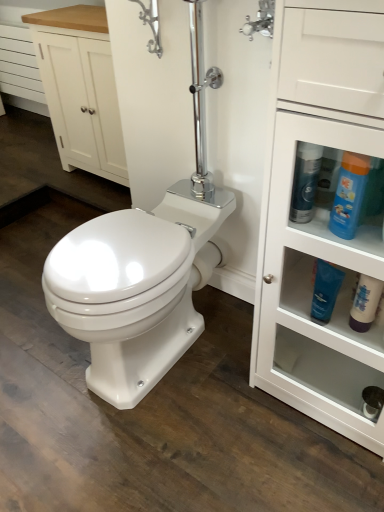
Locate an element on the screen. blue glossy bottle at right, which is counted as the 1th cleaning product, starting from the left is located at coordinates (305, 181).

Measure the distance between point (286, 94) and camera.

A distance of 29.88 inches exists between point (286, 94) and camera.

This screenshot has height=512, width=384. What do you see at coordinates (80, 88) in the screenshot?
I see `white wood cabinet at upper left` at bounding box center [80, 88].

This screenshot has height=512, width=384. I want to click on white matte bottle at lower right, which is the first cleaning product from right to left, so click(365, 303).

Image resolution: width=384 pixels, height=512 pixels. What do you see at coordinates (325, 290) in the screenshot? I see `blue glossy tube at lower right, acting as the 2th cleaning product starting from the left` at bounding box center [325, 290].

The width and height of the screenshot is (384, 512). Identify the location of blue glossy bottle at right, which is counted as the fourth cleaning product, starting from the right. (305, 181).

Is blue glossy tube at lower right, acting as the 2th cleaning product starting from the left, directly adjacent to white wood drawer at upper left?

No, blue glossy tube at lower right, acting as the 2th cleaning product starting from the left, is not touching white wood drawer at upper left.

From a real-world perspective, is blue glossy tube at lower right, the third cleaning product viewed from the right, physically above white wood drawer at upper left?

Indeed, from a real-world perspective, blue glossy tube at lower right, the third cleaning product viewed from the right, stands above white wood drawer at upper left.

From the image's perspective, is blue glossy tube at lower right, acting as the 2th cleaning product starting from the left, below white wood drawer at upper left?

Correct, blue glossy tube at lower right, acting as the 2th cleaning product starting from the left, appears lower than white wood drawer at upper left in the image.

Considering the positions of objects blue glossy tube at lower right, acting as the 2th cleaning product starting from the left, and white wood drawer at upper left in the image provided, who is more to the left, blue glossy tube at lower right, acting as the 2th cleaning product starting from the left, or white wood drawer at upper left?

Positioned to the left is white wood drawer at upper left.

Can you see white glossy cabinet at right touching blue plastic bottle at upper right, which is the 3th cleaning product in left-to-right order?

white glossy cabinet at right and blue plastic bottle at upper right, which is the 3th cleaning product in left-to-right order, are not in contact.

Where is `the 2nd cleaning product directly above the white glossy cabinet at right (from a real-world perspective)`? The height and width of the screenshot is (512, 384). the 2nd cleaning product directly above the white glossy cabinet at right (from a real-world perspective) is located at coordinates (349, 194).

Is white glossy cabinet at right taller than blue plastic bottle at upper right, the second cleaning product when ordered from right to left?

Yes.

Considering the points (282, 273) and (346, 192), which point is behind, point (282, 273) or point (346, 192)?

Point (282, 273)

The height and width of the screenshot is (512, 384). What are the coordinates of `drawer below the white wood cabinet at upper left (from a real-world perspective)` in the screenshot? It's located at (19, 64).

Between white wood drawer at upper left and white wood cabinet at upper left, which one has more height?

white wood cabinet at upper left.

Is white wood drawer at upper left to the right of white wood cabinet at upper left from the viewer's perspective?

No, white wood drawer at upper left is not to the right of white wood cabinet at upper left.

Who is bigger, white wood drawer at upper left or white wood cabinet at upper left?

white wood cabinet at upper left is bigger.

Is white wood cabinet at upper left positioned before white glossy cabinet at right?

No, it is behind white glossy cabinet at right.

Is white glossy cabinet at right located within white wood cabinet at upper left?

No, white glossy cabinet at right is not a part of white wood cabinet at upper left.

Identify the location of bathroom cabinet below the white wood cabinet at upper left (from the image's perspective). This screenshot has height=512, width=384. (322, 215).

In the scene shown: From a real-world perspective, who is located higher, white matte bottle at lower right, which is the first cleaning product from right to left, or blue glossy bottle at right, which is counted as the 1th cleaning product, starting from the left?

blue glossy bottle at right, which is counted as the 1th cleaning product, starting from the left.

From the image's perspective, which object appears higher, white matte bottle at lower right, the 4th cleaning product positioned from the left, or blue glossy bottle at right, which is counted as the fourth cleaning product, starting from the right?

From the image's view, blue glossy bottle at right, which is counted as the fourth cleaning product, starting from the right, is above.

Which object is closer to the camera taking this photo, white matte bottle at lower right, which is the first cleaning product from right to left, or blue glossy bottle at right, which is counted as the 1th cleaning product, starting from the left?

blue glossy bottle at right, which is counted as the 1th cleaning product, starting from the left, is more forward.

Can you confirm if white matte bottle at lower right, the 4th cleaning product positioned from the left, is taller than blue glossy bottle at right, which is counted as the 1th cleaning product, starting from the left?

In fact, white matte bottle at lower right, the 4th cleaning product positioned from the left, may be shorter than blue glossy bottle at right, which is counted as the 1th cleaning product, starting from the left.

Identify the location of the 2nd cleaning product to the left of the white matte bottle at lower right, the 4th cleaning product positioned from the left, counting from the anchor's position. Image resolution: width=384 pixels, height=512 pixels. (325, 290).

From the image's perspective, does white matte bottle at lower right, the 4th cleaning product positioned from the left, appear lower than blue glossy tube at lower right, the third cleaning product viewed from the right?

Correct, white matte bottle at lower right, the 4th cleaning product positioned from the left, appears lower than blue glossy tube at lower right, the third cleaning product viewed from the right, in the image.

Could you tell me if white matte bottle at lower right, the 4th cleaning product positioned from the left, is facing blue glossy tube at lower right, the third cleaning product viewed from the right?

No, white matte bottle at lower right, the 4th cleaning product positioned from the left, does not turn towards blue glossy tube at lower right, the third cleaning product viewed from the right.

Considering the sizes of objects white matte bottle at lower right, the 4th cleaning product positioned from the left, and blue glossy tube at lower right, acting as the 2th cleaning product starting from the left, in the image provided, who is thinner, white matte bottle at lower right, the 4th cleaning product positioned from the left, or blue glossy tube at lower right, acting as the 2th cleaning product starting from the left,?

Thinner between the two is blue glossy tube at lower right, acting as the 2th cleaning product starting from the left.

From the image's perspective, which is below, white wood cabinet at upper left or blue plastic bottle at upper right, the second cleaning product when ordered from right to left?

blue plastic bottle at upper right, the second cleaning product when ordered from right to left, appears lower in the image.

Is white wood cabinet at upper left taller or shorter than blue plastic bottle at upper right, which is the 3th cleaning product in left-to-right order?

Clearly, white wood cabinet at upper left is taller compared to blue plastic bottle at upper right, which is the 3th cleaning product in left-to-right order.

Is white wood cabinet at upper left wider than blue plastic bottle at upper right, the second cleaning product when ordered from right to left?

Yes, white wood cabinet at upper left is wider than blue plastic bottle at upper right, the second cleaning product when ordered from right to left.

Which is in front, point (72, 112) or point (340, 169)?

The point (340, 169) is more forward.

At what (x,y) coordinates should I click in order to perform the action: click on cleaning product that is the 2nd object above the white wood drawer at upper left (from a real-world perspective). Please return your answer as a coordinate pair (x, y). The width and height of the screenshot is (384, 512). Looking at the image, I should click on (325, 290).

I want to click on the 1st cleaning product behind the white glossy cabinet at right, so click(x=349, y=194).

From the image, which object appears to be farther from white glossy cabinet at right, white matte bottle at lower right, which is the first cleaning product from right to left, or white wood drawer at upper left?

white wood drawer at upper left lies further to white glossy cabinet at right than the other object.

From the image, which object appears to be nearer to blue glossy tube at lower right, the third cleaning product viewed from the right, blue glossy bottle at right, which is counted as the fourth cleaning product, starting from the right, or white wood cabinet at upper left?

blue glossy bottle at right, which is counted as the fourth cleaning product, starting from the right, lies closer to blue glossy tube at lower right, the third cleaning product viewed from the right, than the other object.

Considering their positions, is white matte bottle at lower right, which is the first cleaning product from right to left, positioned closer to white glossy cabinet at right than blue glossy tube at lower right, the third cleaning product viewed from the right?

blue glossy tube at lower right, the third cleaning product viewed from the right.

Looking at the image, which one is located further to white wood drawer at upper left, blue glossy tube at lower right, the third cleaning product viewed from the right, or blue glossy bottle at right, which is counted as the fourth cleaning product, starting from the right?

Based on the image, blue glossy tube at lower right, the third cleaning product viewed from the right, appears to be further to white wood drawer at upper left.

Which object lies further to the anchor point blue glossy bottle at right, which is counted as the 1th cleaning product, starting from the left, blue glossy tube at lower right, acting as the 2th cleaning product starting from the left, or blue plastic bottle at upper right, which is the 3th cleaning product in left-to-right order?

Based on the image, blue glossy tube at lower right, acting as the 2th cleaning product starting from the left, appears to be further to blue glossy bottle at right, which is counted as the 1th cleaning product, starting from the left.

Which object lies nearer to the anchor point white glossy cabinet at right, white matte bottle at lower right, the 4th cleaning product positioned from the left, or blue glossy bottle at right, which is counted as the 1th cleaning product, starting from the left?

white matte bottle at lower right, the 4th cleaning product positioned from the left, is closer to white glossy cabinet at right.

When comparing their distances from white wood cabinet at upper left, does white wood drawer at upper left or blue glossy tube at lower right, acting as the 2th cleaning product starting from the left, seem closer?

white wood drawer at upper left.

When comparing their distances from white wood cabinet at upper left, does blue glossy tube at lower right, the third cleaning product viewed from the right, or white matte bottle at lower right, which is the first cleaning product from right to left, seem further?

Among the two, white matte bottle at lower right, which is the first cleaning product from right to left, is located further to white wood cabinet at upper left.

Locate an element on the screen. The image size is (384, 512). cleaning product between blue glossy bottle at right, which is counted as the 1th cleaning product, starting from the left, and blue glossy tube at lower right, the third cleaning product viewed from the right, from top to bottom is located at coordinates (349, 194).

At what (x,y) coordinates should I click in order to perform the action: click on cabinetry between white wood drawer at upper left and white matte bottle at lower right, the 4th cleaning product positioned from the left, from left to right. Please return your answer as a coordinate pair (x, y). The image size is (384, 512). Looking at the image, I should click on (80, 88).

Locate an element on the screen. This screenshot has height=512, width=384. cabinetry located between blue glossy bottle at right, which is counted as the fourth cleaning product, starting from the right, and white wood drawer at upper left in the depth direction is located at coordinates [80, 88].

This screenshot has width=384, height=512. In order to click on cleaning product between blue plastic bottle at upper right, which is the 3th cleaning product in left-to-right order, and white matte bottle at lower right, the 4th cleaning product positioned from the left, from top to bottom in this screenshot , I will do `click(325, 290)`.